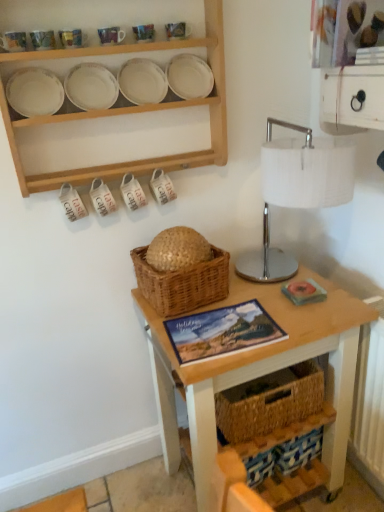
This screenshot has width=384, height=512. Describe the element at coordinates (13, 41) in the screenshot. I see `matte ceramic mug at upper left, the 5th tableware from the right` at that location.

How much space does matte ceramic mug at upper center, which ranks as the 3th tableware in left-to-right order, occupy horizontally?

It is 2.11 inches.

Find the location of `natural wood plates at upper center`. natural wood plates at upper center is located at coordinates (132, 111).

Where is `matte ceramic mug at upper center, which is counted as the 2th tableware, starting from the right`? Image resolution: width=384 pixels, height=512 pixels. matte ceramic mug at upper center, which is counted as the 2th tableware, starting from the right is located at coordinates (144, 33).

Describe the element at coordinates (182, 283) in the screenshot. The height and width of the screenshot is (512, 384). I see `woven straw basket at center` at that location.

Identify the location of matte ceramic mug at upper left, the 5th tableware from the right. This screenshot has height=512, width=384. (13, 41).

Is point (60, 34) positioned behind point (308, 338)?

No, it is not.

Is wooden table at center located within matte ceramic mug at upper center, which ranks as the 3th tableware in left-to-right order?

Actually, wooden table at center is outside matte ceramic mug at upper center, which ranks as the 3th tableware in left-to-right order.

From a real-world perspective, between matte ceramic mug at upper center, which ranks as the 3th tableware in left-to-right order, and wooden table at center, who is vertically higher?

From a 3D spatial view, matte ceramic mug at upper center, which ranks as the 3th tableware in left-to-right order, is above.

What's the angular difference between matte ceramic mug at upper center, the third tableware in the right-to-left sequence, and matte ceramic mug at upper left, marked as the fourth tableware in a right-to-left arrangement,'s facing directions?

There is a 0.98-degree angle between the facing directions of matte ceramic mug at upper center, the third tableware in the right-to-left sequence, and matte ceramic mug at upper left, marked as the fourth tableware in a right-to-left arrangement.

Which of these two, matte ceramic mug at upper center, the third tableware in the right-to-left sequence, or matte ceramic mug at upper left, marked as the fourth tableware in a right-to-left arrangement, is smaller?

With smaller size is matte ceramic mug at upper left, marked as the fourth tableware in a right-to-left arrangement.

Which is behind, matte ceramic mug at upper center, the third tableware in the right-to-left sequence, or matte ceramic mug at upper left, marked as the fourth tableware in a right-to-left arrangement?

matte ceramic mug at upper center, the third tableware in the right-to-left sequence, is further away from the camera.

Is matte ceramic mug at upper center, the third tableware in the right-to-left sequence, taller than matte ceramic mug at upper left, the second tableware positioned from the left?

Correct, matte ceramic mug at upper center, the third tableware in the right-to-left sequence, is much taller as matte ceramic mug at upper left, the second tableware positioned from the left.

Can you confirm if matte ceramic mug at upper left, the 5th tableware from the right, is positioned to the right of matte ceramic mug at upper center, which appears as the first tableware when viewed from the right?

In fact, matte ceramic mug at upper left, the 5th tableware from the right, is to the left of matte ceramic mug at upper center, which appears as the first tableware when viewed from the right.

Is matte ceramic mug at upper left, the first tableware from the left, not near matte ceramic mug at upper center, which appears as the first tableware when viewed from the right?

Actually, matte ceramic mug at upper left, the first tableware from the left, and matte ceramic mug at upper center, which appears as the first tableware when viewed from the right, are a little close together.

Identify the location of the 1st tableware below the matte ceramic mug at upper center, placed as the fifth tableware when sorted from left to right (from a real-world perspective). This screenshot has height=512, width=384. (13, 41).

Is matte ceramic mug at upper left, the first tableware from the left, bigger or smaller than matte ceramic mug at upper center, which appears as the first tableware when viewed from the right?

matte ceramic mug at upper left, the first tableware from the left, is smaller than matte ceramic mug at upper center, which appears as the first tableware when viewed from the right.

Is matte ceramic mug at upper center, placed as the fourth tableware when sorted from left to right, closer to the viewer compared to matte ceramic mug at upper center, which ranks as the 3th tableware in left-to-right order?

No.

Considering the relative sizes of matte ceramic mug at upper center, which is counted as the 2th tableware, starting from the right, and matte ceramic mug at upper center, which ranks as the 3th tableware in left-to-right order, in the image provided, is matte ceramic mug at upper center, which is counted as the 2th tableware, starting from the right, shorter than matte ceramic mug at upper center, which ranks as the 3th tableware in left-to-right order,?

In fact, matte ceramic mug at upper center, which is counted as the 2th tableware, starting from the right, may be taller than matte ceramic mug at upper center, which ranks as the 3th tableware in left-to-right order.

Between matte ceramic mug at upper center, placed as the fourth tableware when sorted from left to right, and matte ceramic mug at upper center, which ranks as the 3th tableware in left-to-right order, which one has smaller size?

Smaller between the two is matte ceramic mug at upper center, placed as the fourth tableware when sorted from left to right.

From the image's perspective, relative to matte ceramic mug at upper center, which ranks as the 3th tableware in left-to-right order, is matte ceramic mug at upper center, which is counted as the 2th tableware, starting from the right, above or below?

Clearly, from the image's perspective, matte ceramic mug at upper center, which is counted as the 2th tableware, starting from the right, is above matte ceramic mug at upper center, which ranks as the 3th tableware in left-to-right order.

Does matte ceramic mug at upper center, placed as the fifth tableware when sorted from left to right, lie behind matte paper book at center?

Yes, matte ceramic mug at upper center, placed as the fifth tableware when sorted from left to right, is further from the camera.

Based on their sizes in the image, would you say matte ceramic mug at upper center, which appears as the first tableware when viewed from the right, is bigger or smaller than matte paper book at center?

Considering their sizes, matte ceramic mug at upper center, which appears as the first tableware when viewed from the right, takes up less space than matte paper book at center.

Considering the sizes of objects matte ceramic mug at upper center, placed as the fifth tableware when sorted from left to right, and matte paper book at center in the image provided, who is wider, matte ceramic mug at upper center, placed as the fifth tableware when sorted from left to right, or matte paper book at center?

Wider between the two is matte paper book at center.

Where is `the 3rd tableware positioned above the matte ceramic mug at upper left, the 5th tableware from the right (from the image's perspective)`? Image resolution: width=384 pixels, height=512 pixels. the 3rd tableware positioned above the matte ceramic mug at upper left, the 5th tableware from the right (from the image's perspective) is located at coordinates (144, 33).

Considering their positions, is matte ceramic mug at upper left, the first tableware from the left, located in front of or behind matte ceramic mug at upper center, placed as the fourth tableware when sorted from left to right?

Visually, matte ceramic mug at upper left, the first tableware from the left, is located in front of matte ceramic mug at upper center, placed as the fourth tableware when sorted from left to right.

Is matte ceramic mug at upper left, the first tableware from the left, positioned far away from matte ceramic mug at upper center, placed as the fourth tableware when sorted from left to right?

No.

Does wooden table at center turn towards white fabric-covered lamp at upper right?

No.

Consider the image. Which of these two, wooden table at center or white fabric-covered lamp at upper right, is smaller?

Smaller between the two is white fabric-covered lamp at upper right.

From the image's perspective, is wooden table at center below white fabric-covered lamp at upper right?

Indeed, from the image's perspective, wooden table at center is shown beneath white fabric-covered lamp at upper right.

Is white fabric-covered lamp at upper right completely or partially inside wooden table at center?

Actually, white fabric-covered lamp at upper right is outside wooden table at center.

Identify the location of table below the matte ceramic mug at upper center, the third tableware in the right-to-left sequence (from the image's perspective). This screenshot has height=512, width=384. (258, 371).

Locate an element on the screen. The image size is (384, 512). the 1st tableware in front of the matte ceramic mug at upper center, which ranks as the 3th tableware in left-to-right order, starting your count from the anchor is located at coordinates tap(42, 40).

Looking at this image, which object lies further to the anchor point matte paper book at center, matte ceramic mug at upper center, placed as the fourth tableware when sorted from left to right, or woven straw basket at center?

matte ceramic mug at upper center, placed as the fourth tableware when sorted from left to right, is further to matte paper book at center.

Based on their spatial positions, is white fabric-covered lamp at upper right or matte ceramic mug at upper center, which is counted as the 2th tableware, starting from the right, further from woven straw basket at center?

Among the two, matte ceramic mug at upper center, which is counted as the 2th tableware, starting from the right, is located further to woven straw basket at center.

When comparing their distances from woven straw basket at center, does matte ceramic mug at upper left, the first tableware from the left, or white fabric-covered lamp at upper right seem closer?

white fabric-covered lamp at upper right is positioned closer to the anchor woven straw basket at center.

Based on the photo, which object lies further to the anchor point matte ceramic mug at upper left, the first tableware from the left, matte ceramic mug at upper center, which ranks as the 3th tableware in left-to-right order, or woven straw basket at center?

woven straw basket at center lies further to matte ceramic mug at upper left, the first tableware from the left, than the other object.

Looking at the image, which one is located closer to natural wood plates at upper center, matte paper book at center or matte ceramic mug at upper center, the third tableware in the right-to-left sequence?

matte ceramic mug at upper center, the third tableware in the right-to-left sequence, is positioned closer to the anchor natural wood plates at upper center.

Estimate the real-world distances between objects in this image. Which object is closer to matte ceramic mug at upper left, marked as the fourth tableware in a right-to-left arrangement, white fabric-covered lamp at upper right or matte paper book at center?

Based on the image, white fabric-covered lamp at upper right appears to be nearer to matte ceramic mug at upper left, marked as the fourth tableware in a right-to-left arrangement.

When comparing their distances from matte paper book at center, does matte ceramic mug at upper left, the second tableware positioned from the left, or matte ceramic mug at upper center, placed as the fourth tableware when sorted from left to right, seem further?

→ matte ceramic mug at upper left, the second tableware positioned from the left, lies further to matte paper book at center than the other object.

From the image, which object appears to be nearer to woven straw basket at center, wooden table at center or white fabric-covered lamp at upper right?

wooden table at center is positioned closer to the anchor woven straw basket at center.

Find the location of a particular element. shelf between matte ceramic mug at upper center, placed as the fifth tableware when sorted from left to right, and white fabric-covered lamp at upper right from top to bottom is located at coordinates (132, 111).

The width and height of the screenshot is (384, 512). In order to click on shelf between matte ceramic mug at upper center, the third tableware in the right-to-left sequence, and matte paper book at center in the up-down direction in this screenshot , I will do `click(132, 111)`.

At what (x,y) coordinates should I click in order to perform the action: click on basket that lies between matte ceramic mug at upper center, the third tableware in the right-to-left sequence, and wooden table at center from top to bottom. Please return your answer as a coordinate pair (x, y). This screenshot has width=384, height=512. Looking at the image, I should click on (182, 283).

Where is `table lamp between matte ceramic mug at upper center, which ranks as the 3th tableware in left-to-right order, and wooden table at center from top to bottom`? table lamp between matte ceramic mug at upper center, which ranks as the 3th tableware in left-to-right order, and wooden table at center from top to bottom is located at coordinates (296, 191).